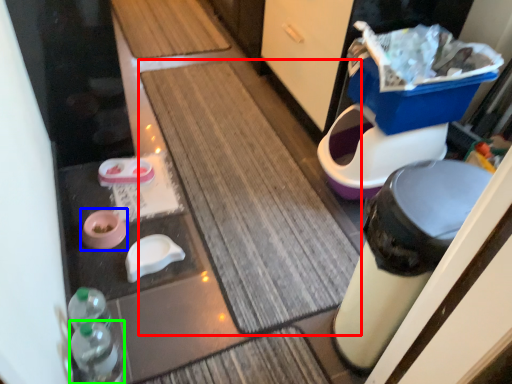
Question: Which object is the closest to the bath mat (highlighted by a red box)? Choose among these: potty (highlighted by a blue box) or bottle (highlighted by a green box).

Choices:
 (A) potty
 (B) bottle

Answer: (A)